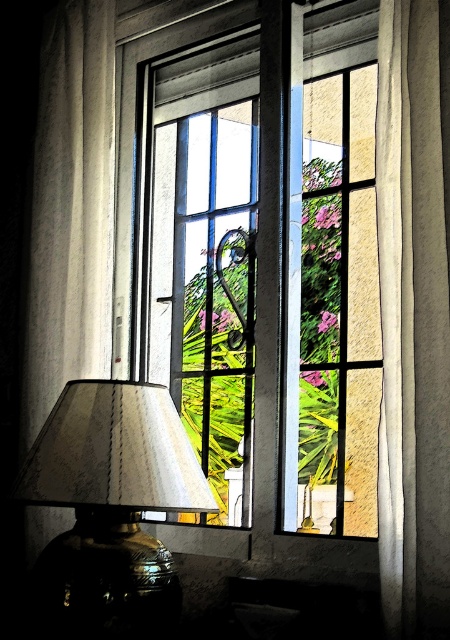
Who is taller, matte silver lampshade at lower left or white textured curtain at right?

white textured curtain at right

Locate an element on the screen. The height and width of the screenshot is (640, 450). matte silver lampshade at lower left is located at coordinates (112, 499).

This screenshot has width=450, height=640. I want to click on matte silver lampshade at lower left, so click(112, 499).

Does clear glass window at center appear on the right side of white textured curtain at right?

No, clear glass window at center is not to the right of white textured curtain at right.

Is clear glass window at center taller than white textured curtain at right?

Indeed, clear glass window at center has a greater height compared to white textured curtain at right.

Between point (187, 192) and point (396, 333), which one is positioned behind?

Point (187, 192)

You are a GUI agent. You are given a task and a screenshot of the screen. Output one action in this format:
    pyautogui.click(x=<x>, y=<y>)
    Task: Click on the clear glass window at center
    The width and height of the screenshot is (450, 640).
    Given the screenshot: What is the action you would take?
    pyautogui.click(x=280, y=275)

Who is more forward, (302, 364) or (54, 486)?

Point (54, 486) is more forward.

From the picture: Between clear glass window at center and matte silver lampshade at lower left, which one appears on the right side from the viewer's perspective?

Positioned to the right is clear glass window at center.

Between point (332, 154) and point (97, 500), which one is positioned in front?

Point (97, 500)

The image size is (450, 640). I want to click on clear glass window at center, so click(280, 275).